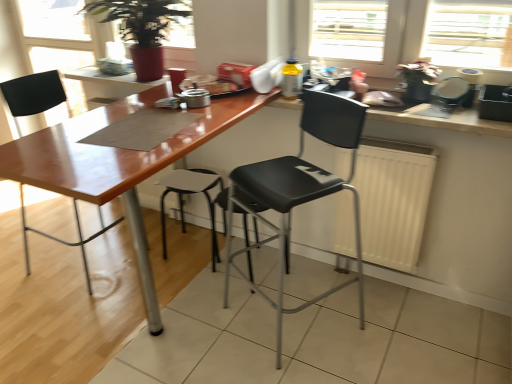
This screenshot has width=512, height=384. I want to click on vacant space underneath matte wood table at center, the first table ordered from the bottom (from a real-world perspective), so click(193, 309).